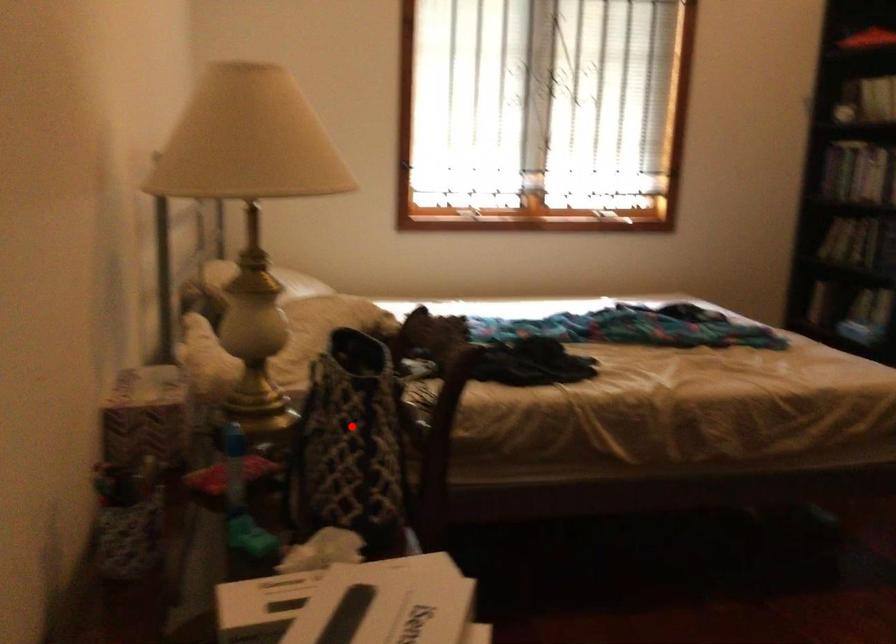
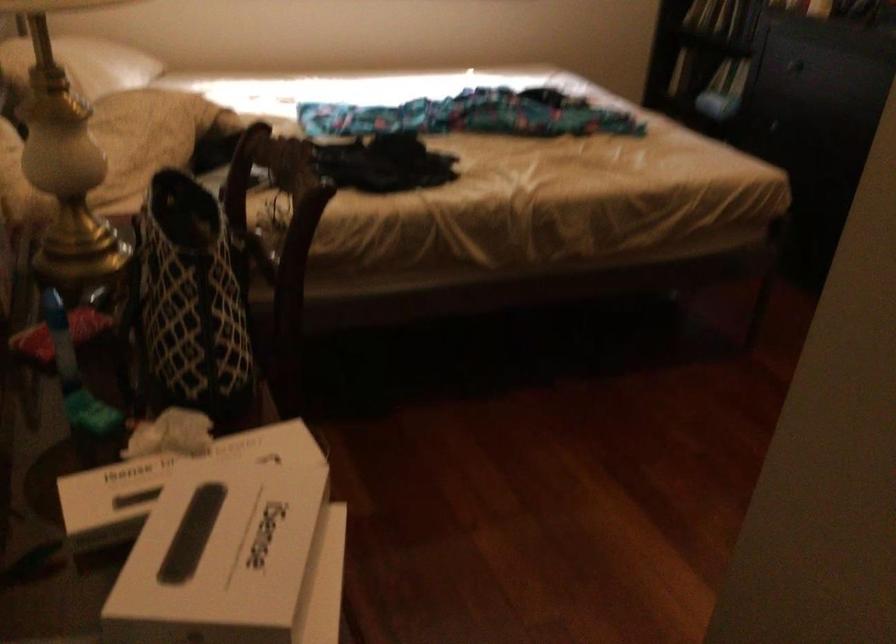
Where in the second image is the point corresponding to the highlighted location from the first image?

(188, 301)